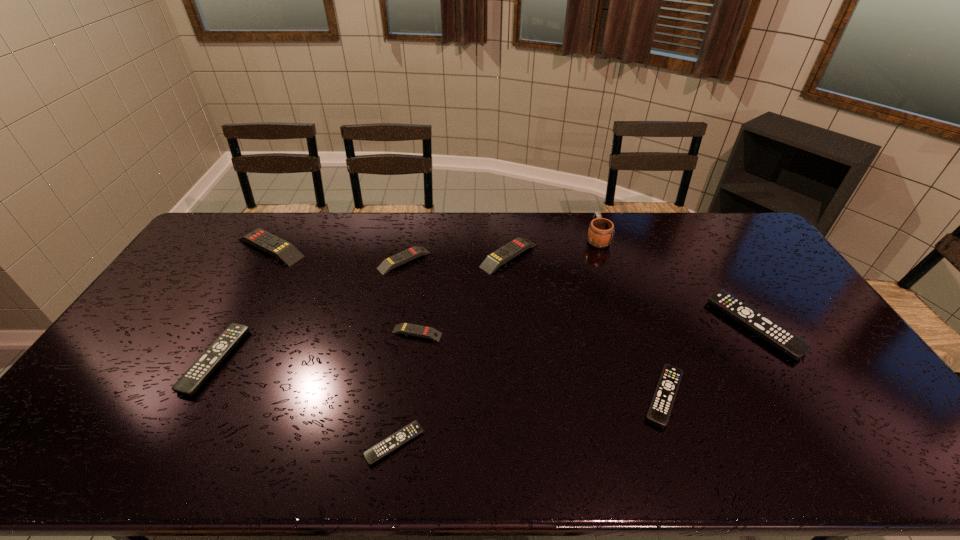
Locate an element on the screen. The height and width of the screenshot is (540, 960). black remote control that is the fourth closest to the tallest remote control is located at coordinates (778, 336).

Select which black remote control is the closest to the leftmost black remote control. Please provide its 2D coordinates. Your answer should be formatted as a tuple, i.e. [(x, y)], where the tuple contains the x and y coordinates of a point satisfying the conditions above.

[(388, 445)]

This screenshot has height=540, width=960. In order to click on vacant position in the image that satisfies the following two spatial constraints: 1. on the front side of the second tallest object; 2. on the left side of the rightmost object in this screenshot , I will do `click(227, 326)`.

This screenshot has width=960, height=540. I want to click on vacant area that satisfies the following two spatial constraints: 1. on the front side of the nearest yellow remote control; 2. on the left side of the second smallest black remote control, so click(408, 396).